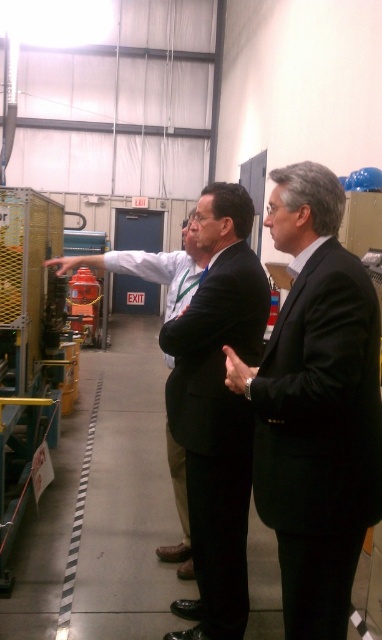
Can you confirm if black suit at center is bigger than matte black suit at center?

No.

Does black suit at center have a lesser height compared to matte black suit at center?

Indeed, black suit at center has a lesser height compared to matte black suit at center.

Who is more forward, (370, 298) or (257, 285)?

Point (370, 298) is in front.

I want to click on black suit at center, so click(x=317, y=406).

Is black suit at center smaller than smooth yellow hand at center?

Correct, black suit at center occupies less space than smooth yellow hand at center.

Can you confirm if black suit at center is bigger than smooth yellow hand at center?

No, black suit at center is not bigger than smooth yellow hand at center.

Identify the location of black suit at center. The image size is (382, 640). (317, 406).

Between point (229, 388) and point (61, 264), which one is positioned in front?

Point (229, 388) is more forward.

Locate an element on the screen. Image resolution: width=382 pixels, height=640 pixels. black matte hand at center is located at coordinates (236, 371).